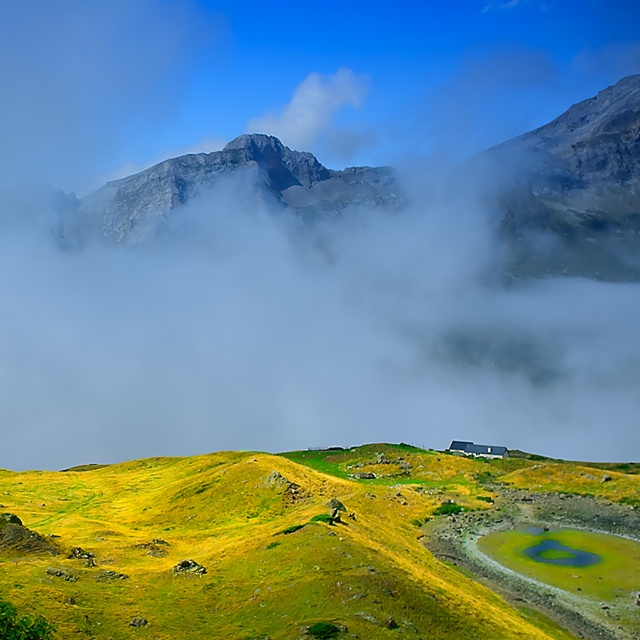
You are hiking and want to take a photo of both the green grassy hillside at center and the rugged granite mountain at upper center. Which object should you position closer to the left side of your camera frame?

The rugged granite mountain at upper center should be positioned closer to the left side of your camera frame because the green grassy hillside at center is on its right side.